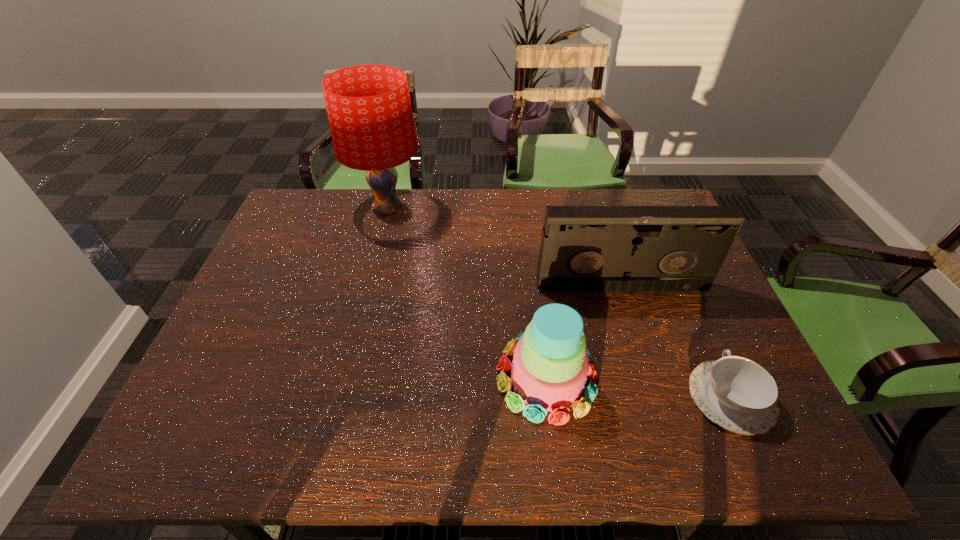
Where is `the leftmost object`? The height and width of the screenshot is (540, 960). the leftmost object is located at coordinates (369, 110).

Image resolution: width=960 pixels, height=540 pixels. Identify the location of the tallest object. (369, 110).

You are a GUI agent. You are given a task and a screenshot of the screen. Output one action in this format:
    pyautogui.click(x=<x>, y=<y>)
    Task: Click on the third shortest object
    The width and height of the screenshot is (960, 540).
    Given the screenshot: What is the action you would take?
    pyautogui.click(x=583, y=248)

Locate an element on the screen. the third nearest object is located at coordinates (583, 248).

Locate an element on the screen. cake is located at coordinates (550, 366).

Image resolution: width=960 pixels, height=540 pixels. I want to click on the shortest object, so click(736, 393).

Image resolution: width=960 pixels, height=540 pixels. Find the location of `free space located 0.120m on the front-facing side of the leftmost object`. free space located 0.120m on the front-facing side of the leftmost object is located at coordinates (460, 209).

Locate an element on the screen. This screenshot has height=540, width=960. free space located on the front side of the videotape is located at coordinates (641, 352).

Image resolution: width=960 pixels, height=540 pixels. In order to click on free space located 0.170m on the left of the cake in this screenshot , I will do (423, 377).

I want to click on vacant space located on the handle side of the shortest object, so [684, 294].